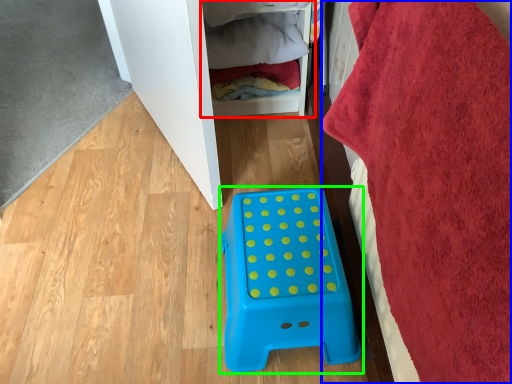
Question: Based on their relative distances, which object is farther from shelf (highlighted by a red box)? Choose from bath towel (highlighted by a blue box) and furniture (highlighted by a green box).

Choices:
 (A) bath towel
 (B) furniture

Answer: (A)